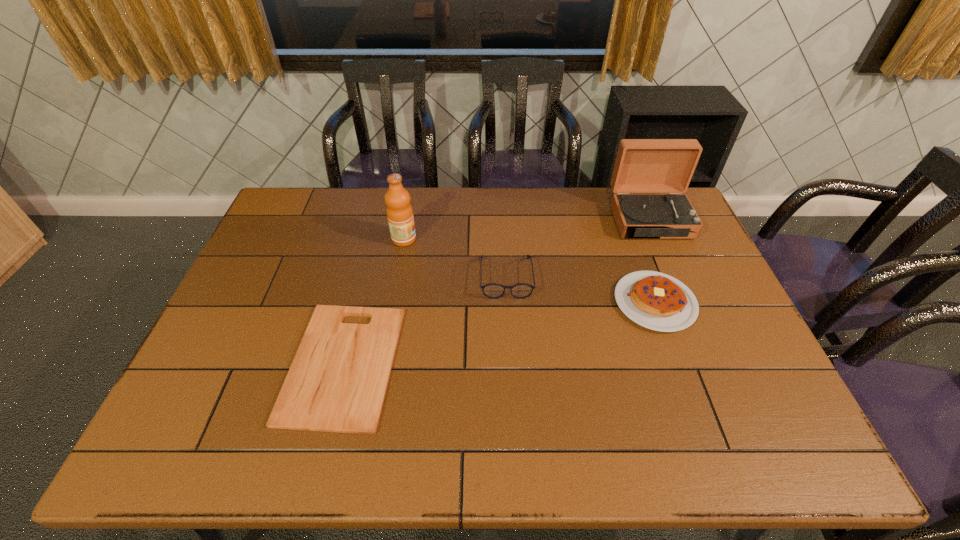
At what (x,y) coordinates should I click in order to perform the action: click on fruit juice. Please return your answer as a coordinate pair (x, y). The height and width of the screenshot is (540, 960). Looking at the image, I should click on (400, 217).

In order to click on phonograph record in this screenshot , I will do `click(642, 165)`.

Where is `the third object from left to right`? the third object from left to right is located at coordinates (493, 290).

Where is `the third shortest object`? the third shortest object is located at coordinates (493, 290).

Image resolution: width=960 pixels, height=540 pixels. I want to click on pancake, so click(657, 301).

Where is `the shortest object`? the shortest object is located at coordinates (337, 382).

The image size is (960, 540). I want to click on free space located 0.380m on the label side of the fruit juice, so click(530, 239).

This screenshot has width=960, height=540. I want to click on vacant space positioned on the face of the phonograph record, so click(x=695, y=327).

This screenshot has width=960, height=540. Find the location of `vacant area situated 0.270m on the front-facing side of the third object from left to right`. vacant area situated 0.270m on the front-facing side of the third object from left to right is located at coordinates (512, 380).

Identify the location of vacant space located 0.340m on the back of the pancake. (620, 207).